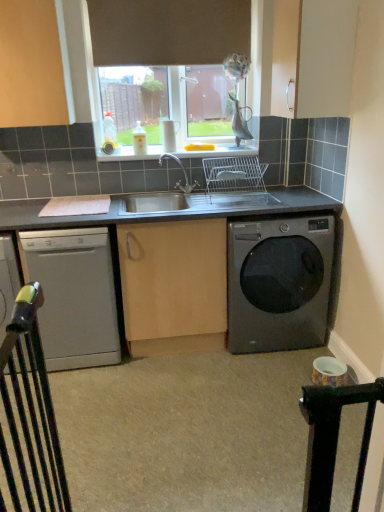
Question: From the image's perspective, is metallic gray washing machine at lower right located above or below satin silver dishwasher at lower left?

Choices:
 (A) above
 (B) below

Answer: (A)

Question: Is point click(249, 352) closer or farther from the camera than point click(77, 294)?

Choices:
 (A) closer
 (B) farther

Answer: (B)

Question: Based on their relative distances, which object is nearer to the black metal gate at lower left?

Choices:
 (A) stainless steel sink at center
 (B) satin silver dishwasher at lower left
 (C) metallic gray washing machine at lower right

Answer: (B)

Question: Which of these objects is positioned farthest from the satin silver dishwasher at lower left?

Choices:
 (A) metallic gray washing machine at lower right
 (B) stainless steel sink at center
 (C) black metal gate at lower left

Answer: (A)